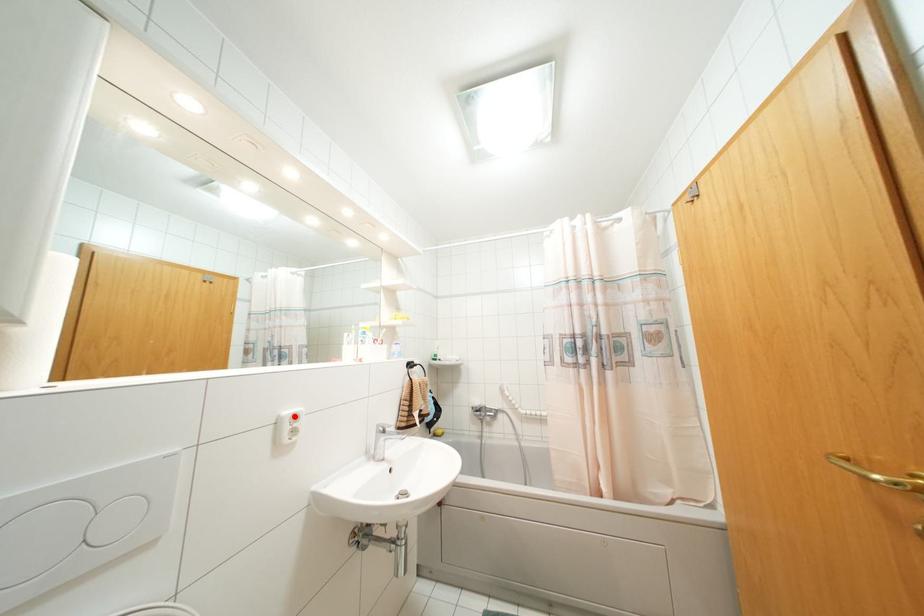
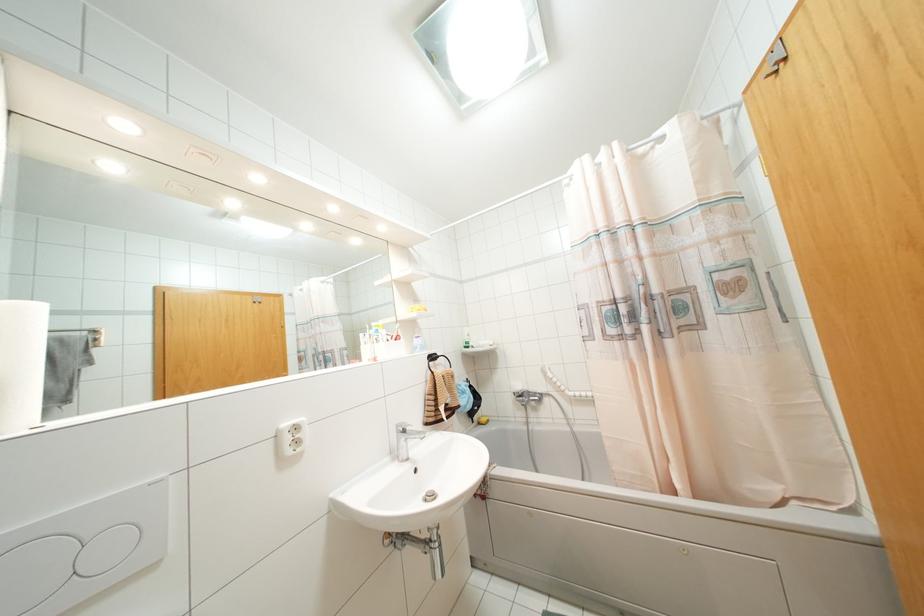
The point at the highlighted location is marked in the first image. Where is the corresponding point in the second image?

(296, 428)